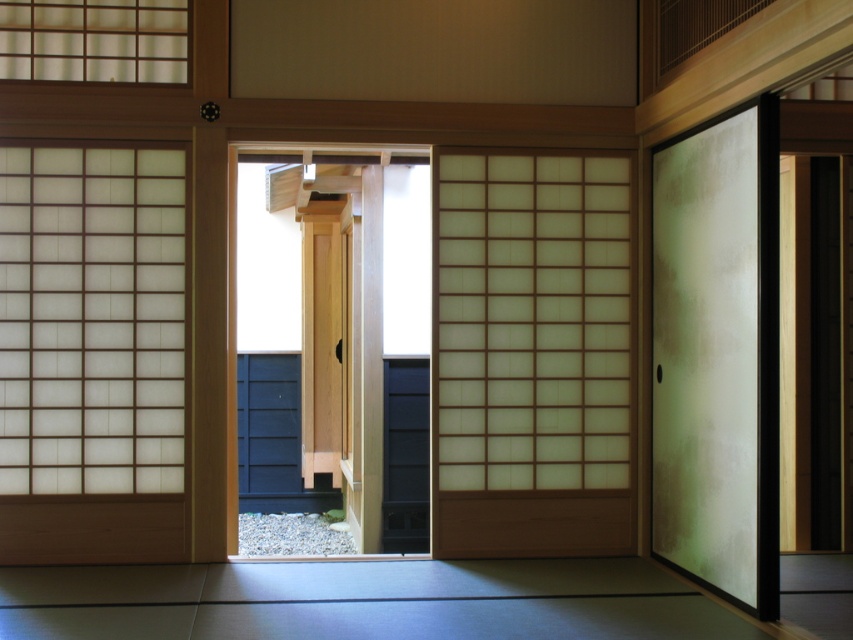
Question: Does satin white screen at center appear on the right side of light wood door at center?

Choices:
 (A) yes
 (B) no

Answer: (A)

Question: Estimate the real-world distances between objects in this image. Which object is closer to the frosted glass sliding door at right?

Choices:
 (A) light wood door at center
 (B) satin white screen at center

Answer: (B)

Question: Is satin white screen at center positioned in front of frosted glass sliding door at right?

Choices:
 (A) yes
 (B) no

Answer: (B)

Question: Estimate the real-world distances between objects in this image. Which object is closer to the light wood door at center?

Choices:
 (A) frosted glass sliding door at right
 (B) satin white screen at center

Answer: (B)

Question: Is frosted glass sliding door at right to the left of light wood door at center from the viewer's perspective?

Choices:
 (A) yes
 (B) no

Answer: (B)

Question: Based on their relative distances, which object is nearer to the satin white screen at center?

Choices:
 (A) light wood door at center
 (B) frosted glass sliding door at right

Answer: (B)